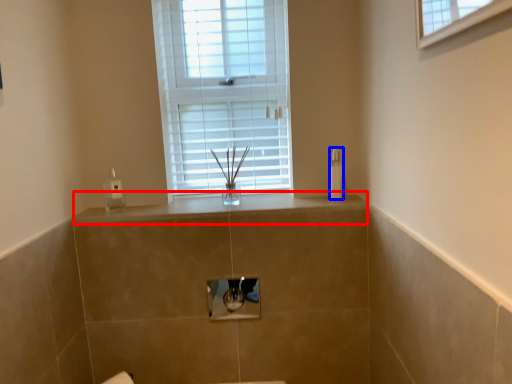
Question: Which object is closer to the camera taking this photo, counter top (highlighted by a red box) or toiletry (highlighted by a blue box)?

Choices:
 (A) counter top
 (B) toiletry

Answer: (A)